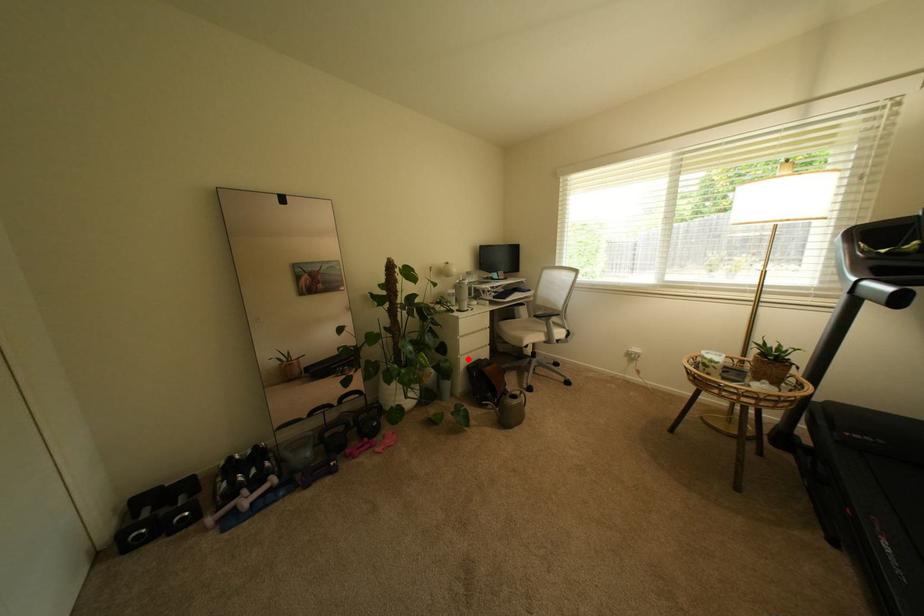
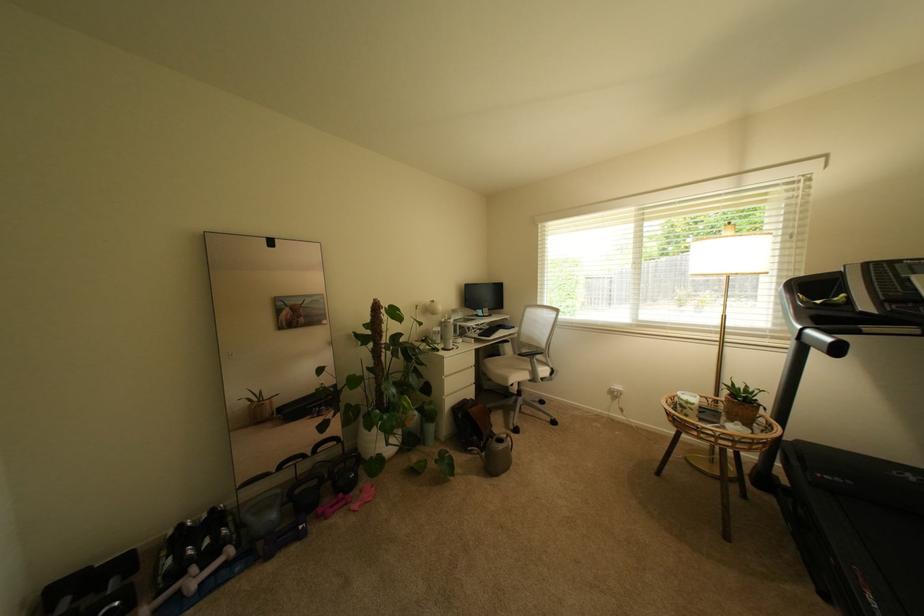
Question: I am providing you with two images of the same scene from different viewpoints. In image1, a red point is highlighted. Considering the same 3D point in image2, which of the following is correct?

Choices:
 (A) It is closer
 (B) It is farther

Answer: (A)